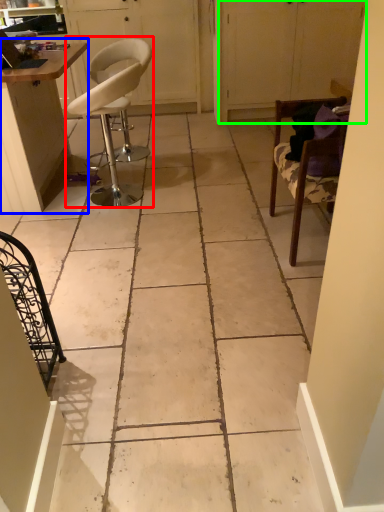
Question: Which object is the closest to the chair (highlighted by a red box)? Choose among these: table (highlighted by a blue box) or screen door (highlighted by a green box).

Choices:
 (A) table
 (B) screen door

Answer: (A)